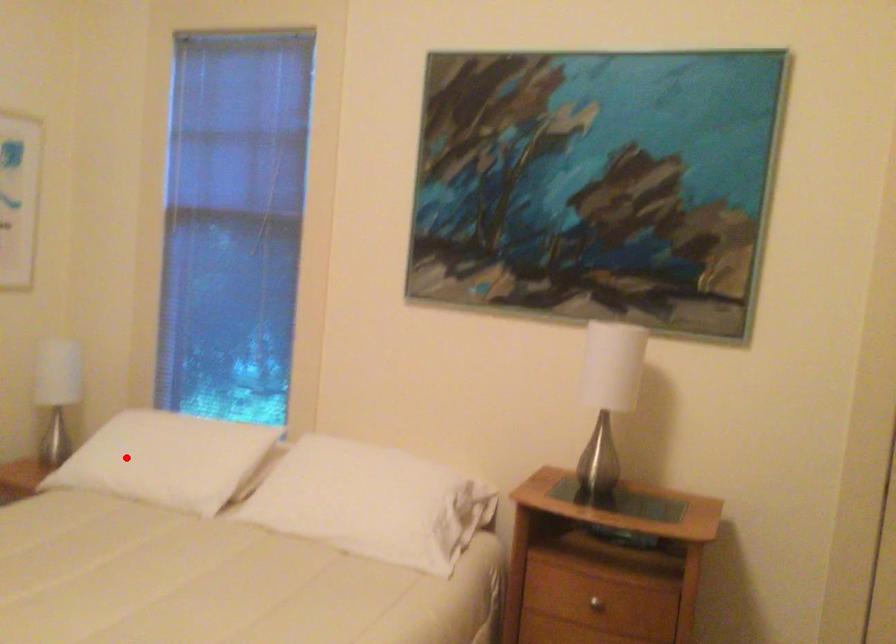
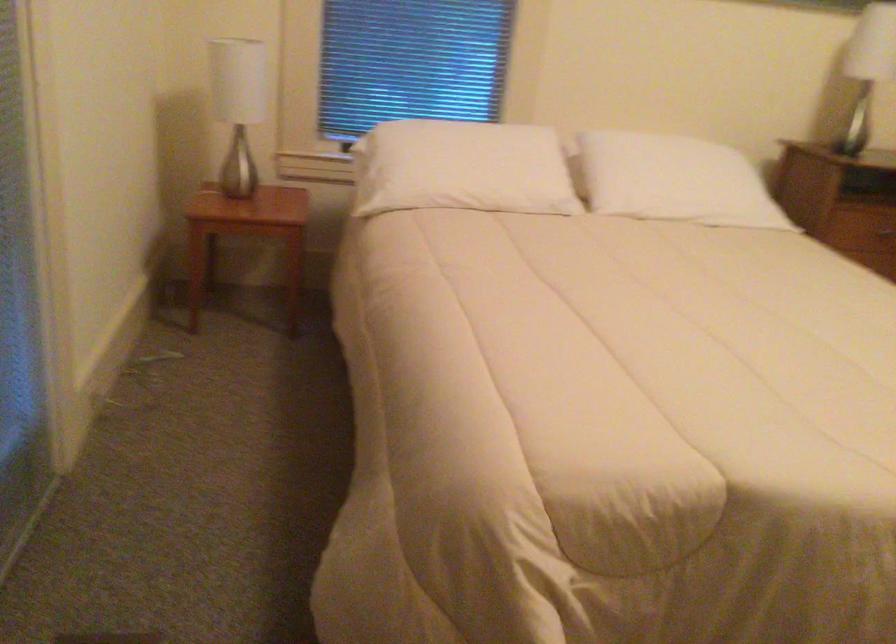
The point at the highlighted location is marked in the first image. Where is the corresponding point in the second image?

(462, 167)